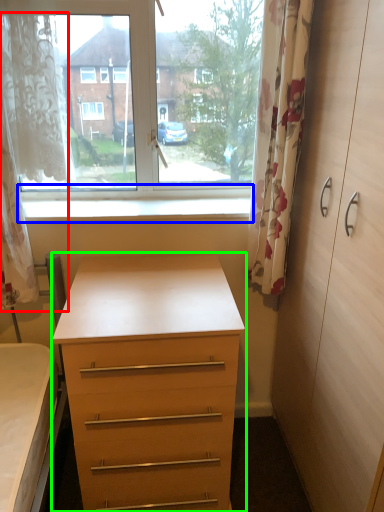
Question: Which object is the farthest from curtain (highlighted by a red box)? Choose among these: window sill (highlighted by a blue box) or chest of drawers (highlighted by a green box).

Choices:
 (A) window sill
 (B) chest of drawers

Answer: (B)